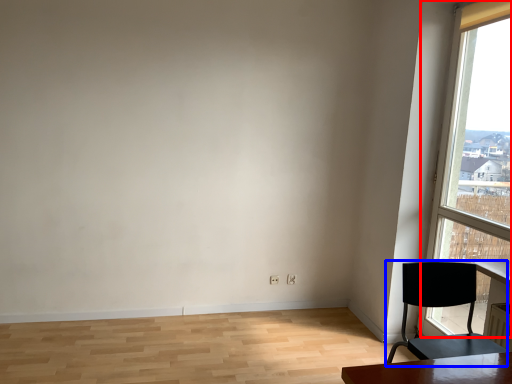
Question: Among these objects, which one is nearest to the camera, window (highlighted by a red box) or chair (highlighted by a blue box)?

Choices:
 (A) window
 (B) chair

Answer: (B)